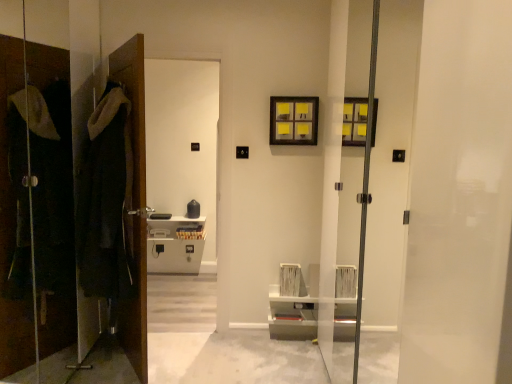
Find the location of a particular element. The height and width of the screenshot is (384, 512). vacant area that is in front of brown wooden door at left is located at coordinates (113, 370).